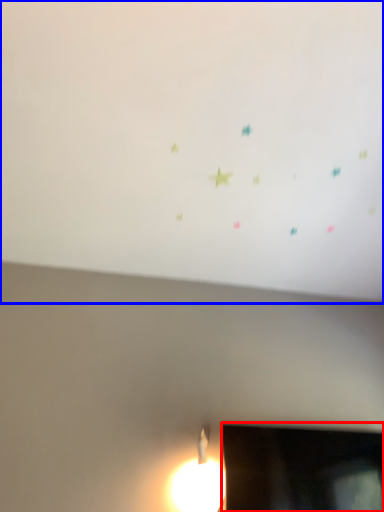
Question: Which object appears closest to the camera in this image, television (highlighted by a red box) or backdrop (highlighted by a blue box)?

Choices:
 (A) television
 (B) backdrop

Answer: (B)